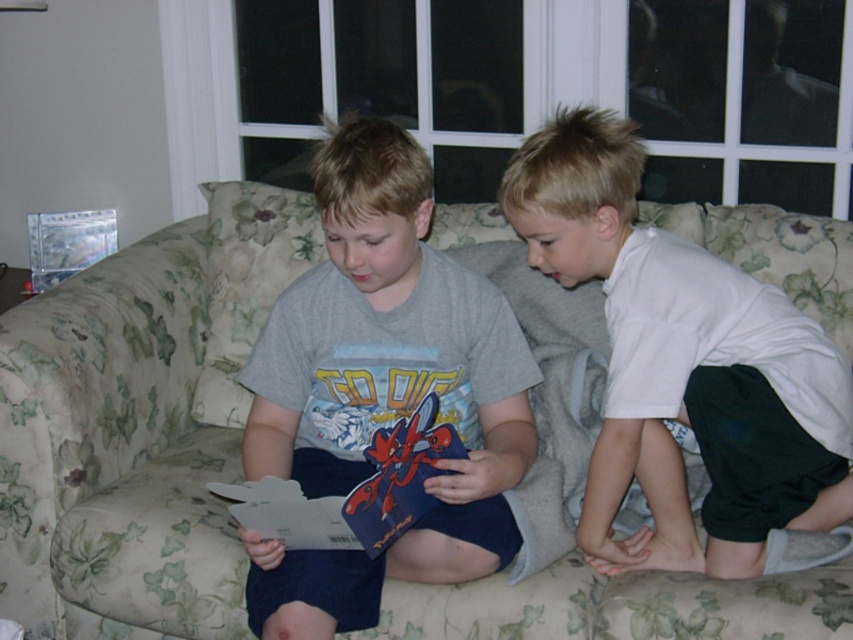
Is floral fabric couch at center shorter than blue matte book at center?

No.

Is the position of floral fabric couch at center less distant than that of blue matte book at center?

No, it is not.

Which is in front, point (218, 204) or point (355, 528)?

Positioned in front is point (355, 528).

Find the location of a particular element. This screenshot has height=640, width=853. floral fabric couch at center is located at coordinates (138, 424).

Is gray cotton shirt at center above white cotton shirt at right?

No, gray cotton shirt at center is not above white cotton shirt at right.

Does point (376, 602) come farther from viewer compared to point (699, 326)?

That is False.

You are a GUI agent. You are given a task and a screenshot of the screen. Output one action in this format:
    pyautogui.click(x=<x>, y=<y>)
    Task: Click on the gray cotton shirt at center
    The width and height of the screenshot is (853, 640).
    Given the screenshot: What is the action you would take?
    pyautogui.click(x=381, y=388)

Is floral fabric couch at center smaller than white cotton shirt at right?

No.

Describe the element at coordinates (138, 424) in the screenshot. This screenshot has height=640, width=853. I see `floral fabric couch at center` at that location.

The width and height of the screenshot is (853, 640). I want to click on floral fabric couch at center, so click(x=138, y=424).